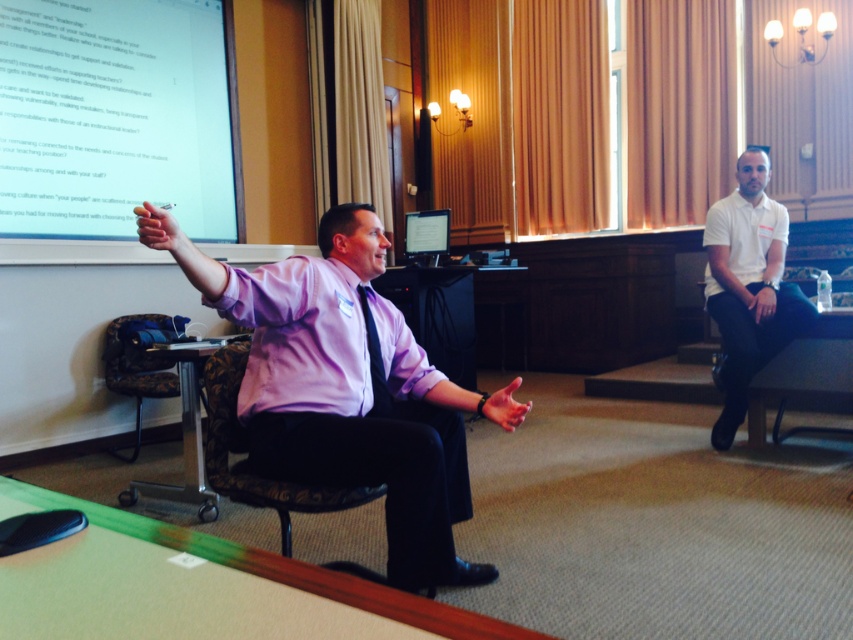
Question: Does matte purple shirt at center appear on the right side of velvet-patterned armchair at center?

Choices:
 (A) no
 (B) yes

Answer: (B)

Question: Where is matte purple shirt at center located in relation to white paper at upper left in the image?

Choices:
 (A) left
 (B) right

Answer: (B)

Question: Which object is farther from the camera taking this photo?

Choices:
 (A) white paper at upper left
 (B) black satin tie at center

Answer: (A)

Question: Which of the following is the farthest from the observer?

Choices:
 (A) (387, 472)
 (B) (296, 497)
 (C) (763, 232)
 (D) (16, 70)

Answer: (D)

Question: Observing the image, what is the correct spatial positioning of white paper at upper left in reference to purple satin dress shirt at center?

Choices:
 (A) below
 (B) above

Answer: (B)

Question: Which of the following is the closest to the observer?

Choices:
 (A) purple satin dress shirt at center
 (B) black satin tie at center
 (C) matte purple shirt at center
 (D) velvet-patterned armchair at center

Answer: (C)